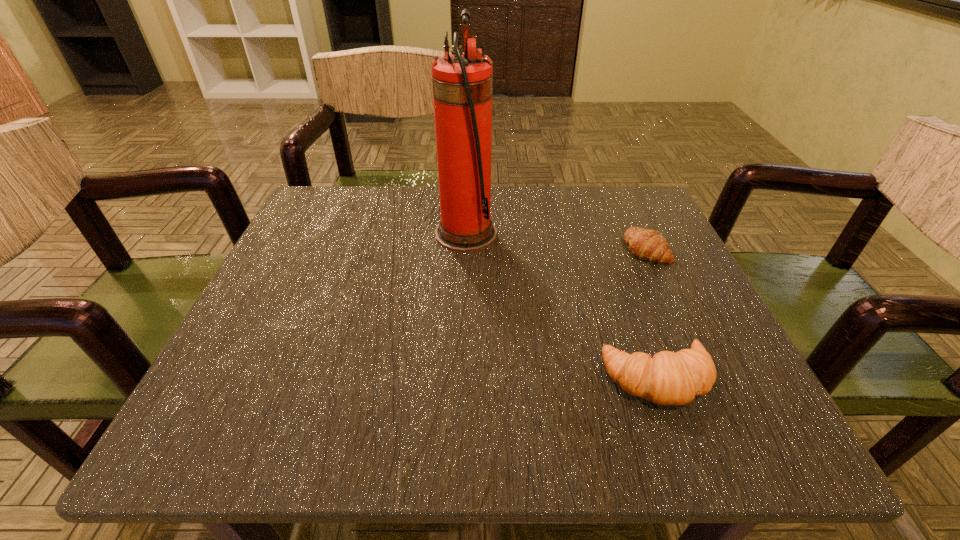
You are a GUI agent. You are given a task and a screenshot of the screen. Output one action in this format:
    pyautogui.click(x=<x>, y=<y>)
    Task: Click on the free space between the nearest object and the farther crescent roll
    The width and height of the screenshot is (960, 540).
    Given the screenshot: What is the action you would take?
    tap(652, 314)

Locate an element on the screen. The height and width of the screenshot is (540, 960). free space between the shorter crescent roll and the nearer crescent roll is located at coordinates (652, 314).

Identify which object is the closest to the shortest object. Please provide its 2D coordinates. Your answer should be formatted as a tuple, i.e. [(x, y)], where the tuple contains the x and y coordinates of a point satisfying the conditions above.

[(669, 378)]

Identify the location of object that is the closest to the shorter crescent roll. (669, 378).

Identify the location of free space that satisfies the following two spatial constraints: 1. at the discharge end of the fire extinguisher; 2. on the back side of the shortest object. (466, 249).

Where is `free space in the image that satisfies the following two spatial constraints: 1. at the discharge end of the shorter crescent roll; 2. on the left side of the fire extinguisher`? free space in the image that satisfies the following two spatial constraints: 1. at the discharge end of the shorter crescent roll; 2. on the left side of the fire extinguisher is located at coordinates (466, 249).

You are a GUI agent. You are given a task and a screenshot of the screen. Output one action in this format:
    pyautogui.click(x=<x>, y=<y>)
    Task: Click on the vacant space that satisfies the following two spatial constraints: 1. on the back side of the nearest object; 2. at the discharge end of the fire extinguisher
    Image resolution: width=960 pixels, height=540 pixels.
    Given the screenshot: What is the action you would take?
    pyautogui.click(x=605, y=233)

You are a GUI agent. You are given a task and a screenshot of the screen. Output one action in this format:
    pyautogui.click(x=<x>, y=<y>)
    Task: Click on the blank space that satisfies the following two spatial constraints: 1. at the discharge end of the leftmost object; 2. on the left side of the shortest object
    The image size is (960, 540).
    Given the screenshot: What is the action you would take?
    pyautogui.click(x=466, y=249)

Where is `vacant position in the image that satisfies the following two spatial constraints: 1. at the discharge end of the nearest object; 2. on the left side of the fire extinguisher`? This screenshot has height=540, width=960. vacant position in the image that satisfies the following two spatial constraints: 1. at the discharge end of the nearest object; 2. on the left side of the fire extinguisher is located at coordinates (460, 379).

Locate an element on the screen. vacant space that satisfies the following two spatial constraints: 1. at the discharge end of the shortest object; 2. on the right side of the tallest object is located at coordinates (466, 249).